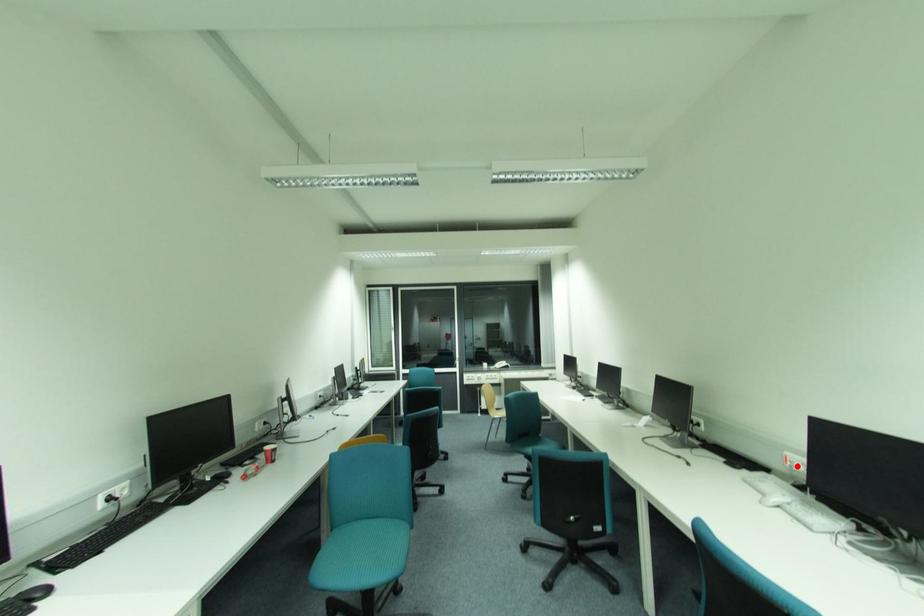
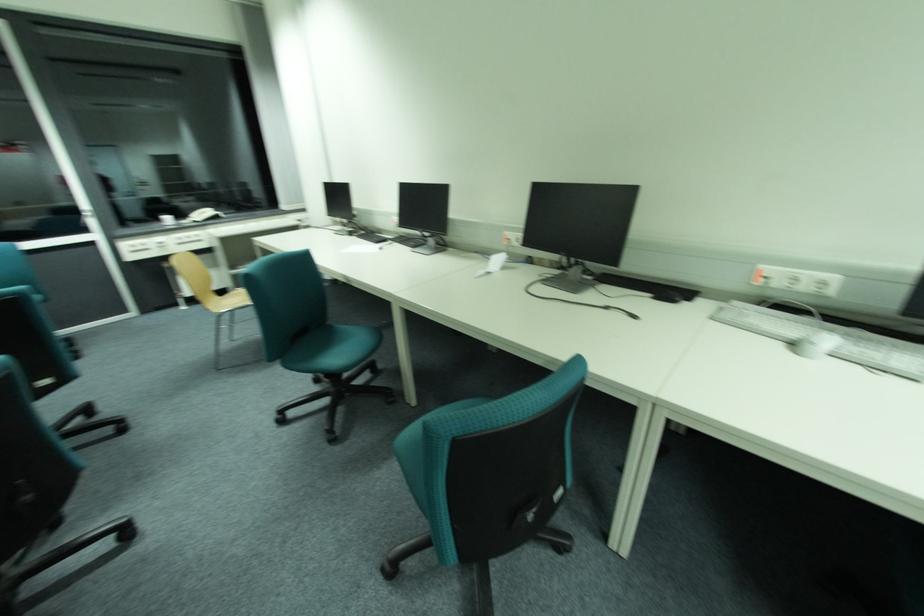
Find the pixel in the second image that matches the highlighted location in the first image.

(772, 283)